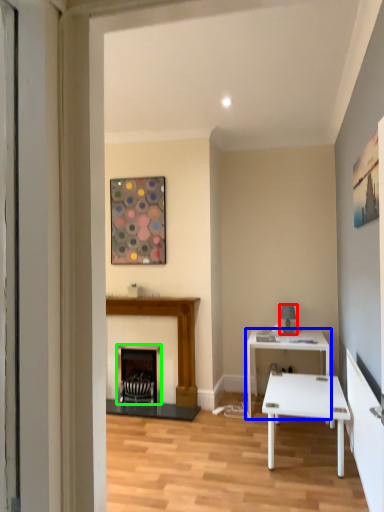
Question: Which object is the closest to the lamp (highlighted by a red box)? Choose among these: table (highlighted by a blue box) or fireplace (highlighted by a green box).

Choices:
 (A) table
 (B) fireplace

Answer: (A)